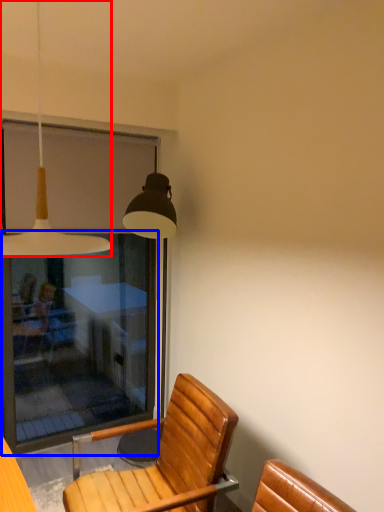
Question: Which point is further to the camera, lamp (highlighted by a red box) or screen door (highlighted by a blue box)?

Choices:
 (A) lamp
 (B) screen door

Answer: (B)